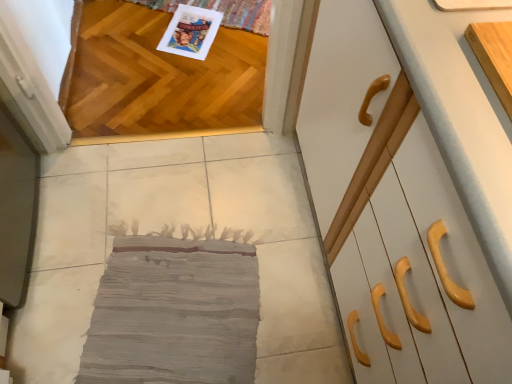
Question: Relative to shiny oak hardwood at upper left, is light wood cutting board at upper right, the first cabinetry positioned from the back, in front or behind?

Choices:
 (A) front
 (B) behind

Answer: (A)

Question: From the image's perspective, is light wood cutting board at upper right, the first cabinetry positioned from the back, located above or below shiny oak hardwood at upper left?

Choices:
 (A) below
 (B) above

Answer: (A)

Question: Based on their relative distances, which object is nearer to the gray fabric rug at center?

Choices:
 (A) shiny oak hardwood at upper left
 (B) light wood cutting board at upper right, the first cabinetry positioned from the back
 (C) white glossy cabinet at right, the 2th cabinetry viewed from the back

Answer: (A)

Question: Which of these objects is positioned farthest from the gray fabric rug at center?

Choices:
 (A) shiny oak hardwood at upper left
 (B) light wood cutting board at upper right, the first cabinetry positioned from the back
 (C) white glossy cabinet at right, the first cabinetry when ordered from front to back

Answer: (B)